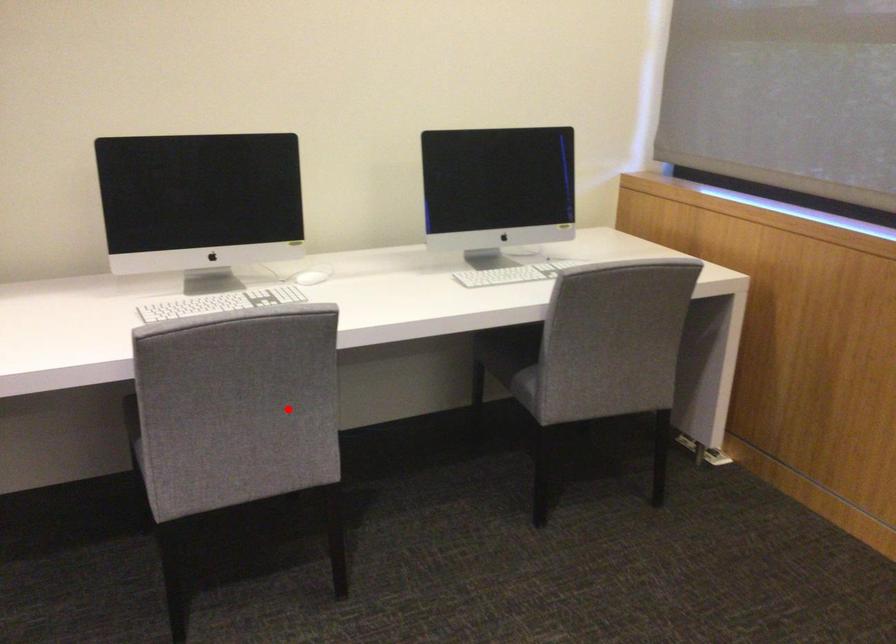
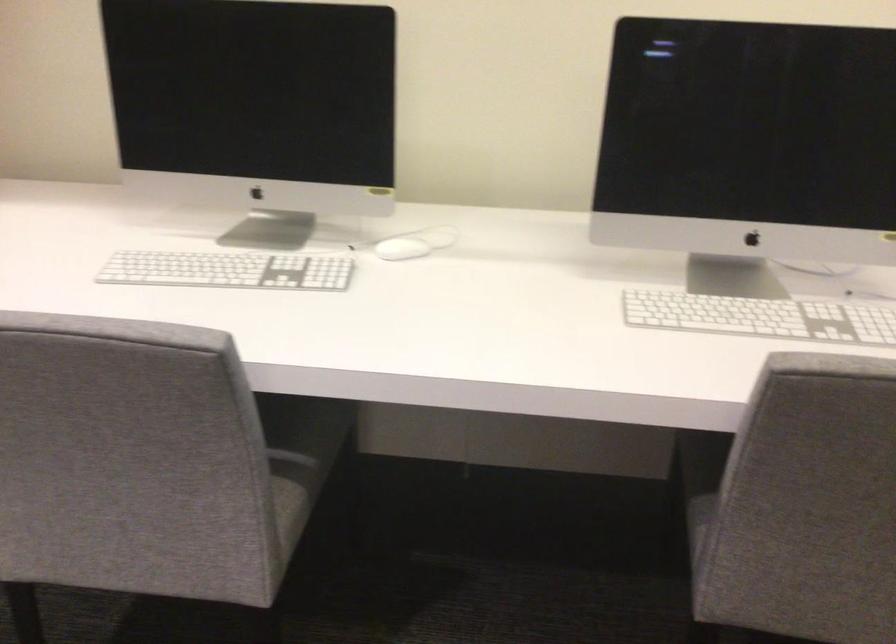
Where in the second image is the point corresponding to the highlighted location from the first image?

(291, 456)